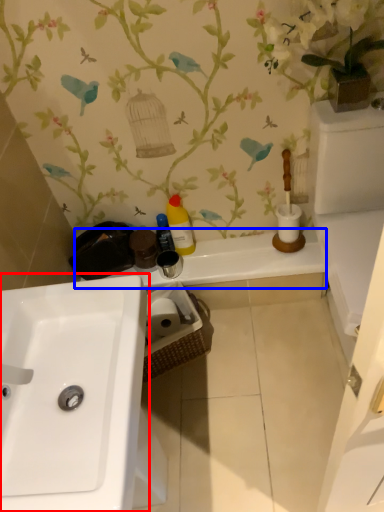
Question: Which point is further to the camera, sink (highlighted by a red box) or counter top (highlighted by a blue box)?

Choices:
 (A) sink
 (B) counter top

Answer: (B)